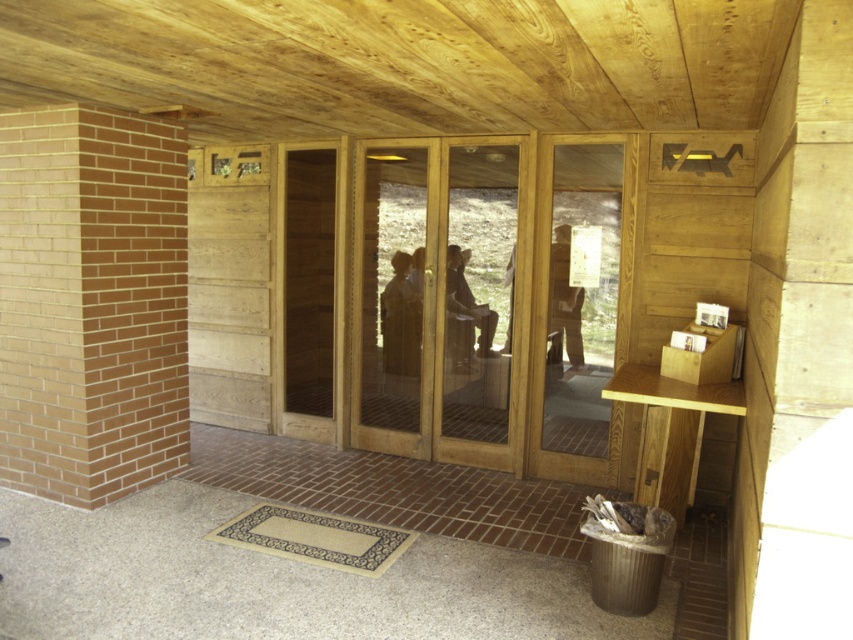
You are standing at the entrance of the building and want to move towards the point marked as point (308,412). Which direction should you move relative to point (453,358)?

To reach point (308,412) from point (453,358), you should move towards it since it is behind point (453,358).

You are a delivery person trying to bring a package through the entrance. The package is 2 meters wide. You see the wooden door at center and the smooth wooden chair at center. Can the package fit through the entrance? Please explain your reasoning based on the objects in the scene.

The wooden door at center might be wider than smooth wooden chair at center. Since the package is 2 meters wide, but the exact width of the door is not specified, it is uncertain whether the package can fit through the entrance. Further measurement of the door width is needed.